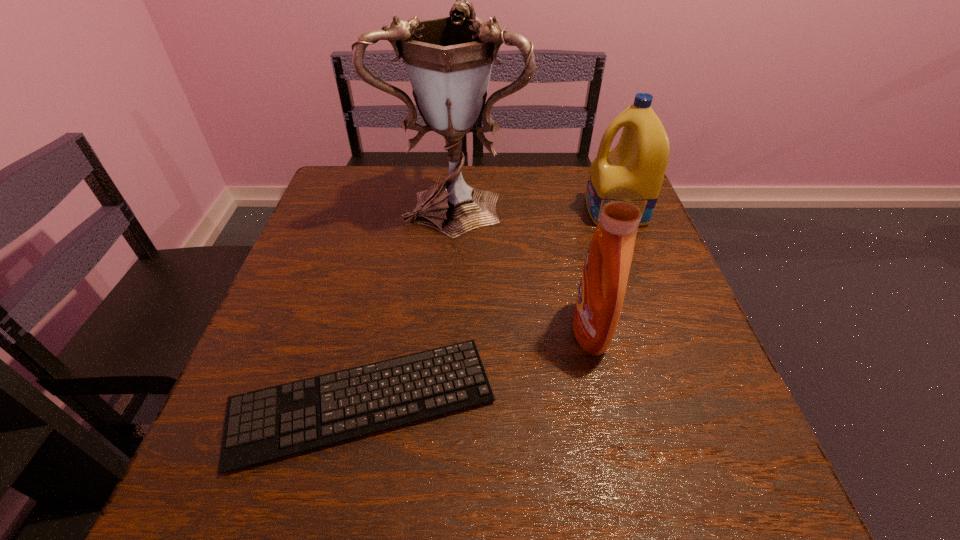
Where is `vacant position located on the label of the rightmost object`? The width and height of the screenshot is (960, 540). vacant position located on the label of the rightmost object is located at coordinates (507, 211).

Image resolution: width=960 pixels, height=540 pixels. What are the coordinates of `vacant area located on the label of the rightmost object` in the screenshot? It's located at (491, 211).

This screenshot has width=960, height=540. Find the location of `free location located 0.240m on the label of the rightmost object`. free location located 0.240m on the label of the rightmost object is located at coordinates (491, 211).

In order to click on vacant space located 0.250m on the back of the shortest object in this screenshot , I will do `click(395, 254)`.

Where is `trophy cup that is at the far edge`? trophy cup that is at the far edge is located at coordinates (448, 60).

At what (x,y) coordinates should I click in order to perform the action: click on detergent located in the far edge section of the desktop. Please return your answer as a coordinate pair (x, y). The image size is (960, 540). Looking at the image, I should click on (639, 161).

The height and width of the screenshot is (540, 960). In order to click on object located in the near edge section of the desktop in this screenshot , I will do `click(267, 424)`.

Find the location of `object positioned at the left edge`. object positioned at the left edge is located at coordinates (267, 424).

This screenshot has width=960, height=540. In order to click on object that is at the right edge in this screenshot , I will do `click(639, 161)`.

I want to click on object that is at the near left corner, so click(267, 424).